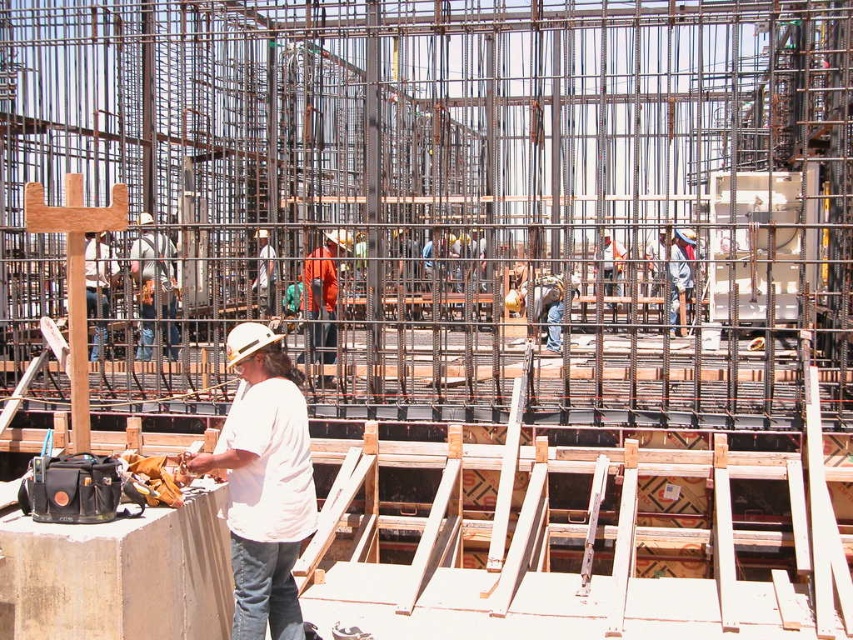
Question: Does orange fabric safety vest at center have a larger size compared to white hard hat at center?

Choices:
 (A) yes
 (B) no

Answer: (B)

Question: Which point is farther to the camera?

Choices:
 (A) (322, 257)
 (B) (109, 264)
 (C) (299, 532)
 (D) (177, 346)

Answer: (D)

Question: Can you confirm if white matte shirt at center is positioned below orange safety vest at center?

Choices:
 (A) no
 (B) yes

Answer: (B)

Question: Estimate the real-world distances between objects in this image. Which object is farther from the orange fabric safety vest at center?

Choices:
 (A) orange safety vest at center
 (B) white matte shirt at center
 (C) white hard hat at center

Answer: (B)

Question: Which object is positioned closest to the white matte shirt at center?

Choices:
 (A) white hard hat at center
 (B) orange fabric safety vest at center

Answer: (B)

Question: Can you confirm if orange safety vest at center is positioned to the right of orange fabric safety vest at center?

Choices:
 (A) yes
 (B) no

Answer: (B)